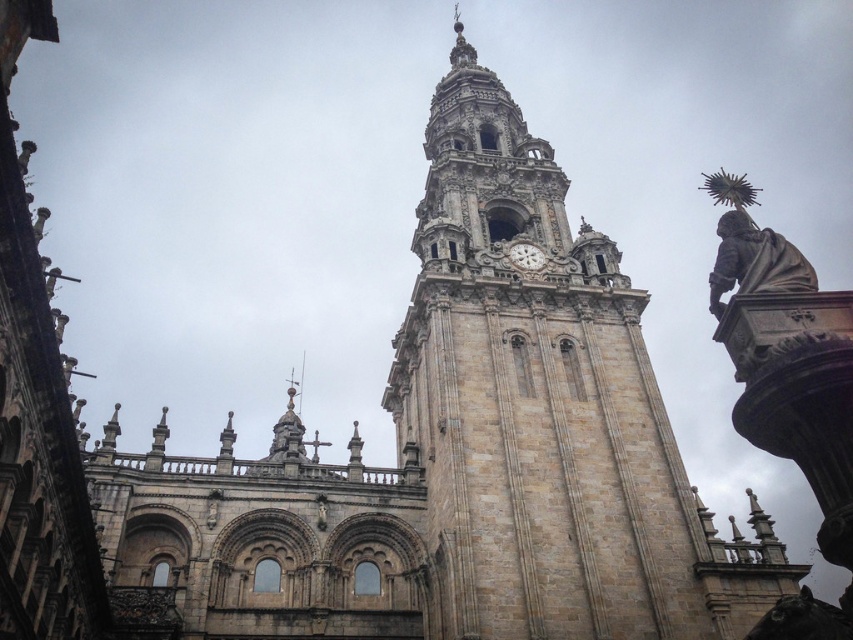
Question: Among these objects, which one is farthest from the camera?

Choices:
 (A) brown stone tower at center
 (B) bronze statue at right

Answer: (A)

Question: Where is bronze statue at right located in relation to white stone clock at center in the image?

Choices:
 (A) left
 (B) right

Answer: (B)

Question: Is brown stone tower at center in front of white stone clock at center?

Choices:
 (A) no
 (B) yes

Answer: (B)

Question: Is brown stone tower at center below bronze statue at right?

Choices:
 (A) no
 (B) yes

Answer: (A)

Question: Among these objects, which one is nearest to the camera?

Choices:
 (A) brown stone tower at center
 (B) white stone clock at center
 (C) bronze statue at right

Answer: (C)

Question: Estimate the real-world distances between objects in this image. Which object is farther from the brown stone tower at center?

Choices:
 (A) bronze statue at right
 (B) white stone clock at center

Answer: (A)